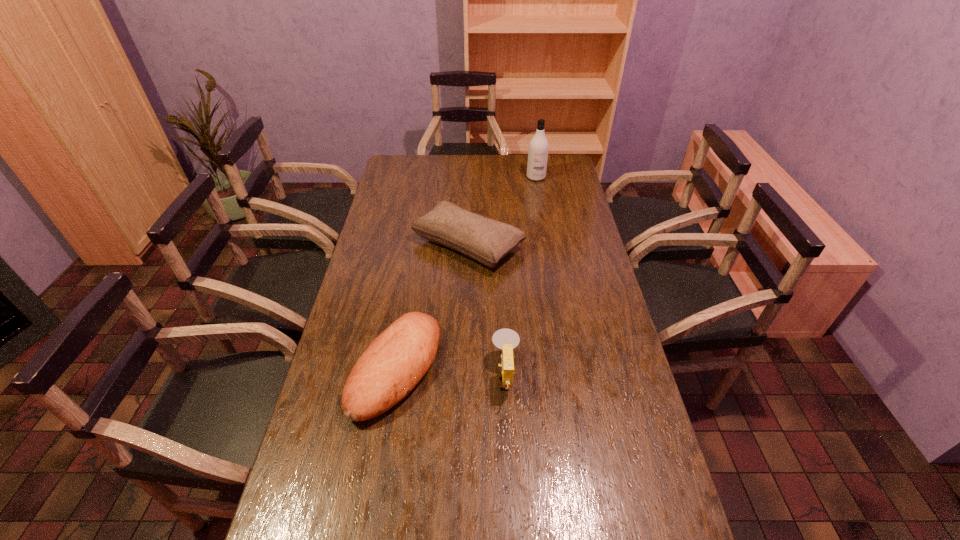
Where is `shampoo`? This screenshot has height=540, width=960. shampoo is located at coordinates (538, 147).

Find the location of `the farthest object`. the farthest object is located at coordinates (538, 147).

Find the location of a particular element. the second farthest object is located at coordinates (485, 240).

Locate an element on the screen. sponge is located at coordinates (506, 339).

Identify the location of bread. The width and height of the screenshot is (960, 540). (394, 363).

Find the location of a particular element. vacant space positioned 0.160m on the front-facing side of the rightmost object is located at coordinates (540, 201).

Image resolution: width=960 pixels, height=540 pixels. I want to click on vacant position located 0.100m on the back of the second farthest object, so click(x=469, y=204).

The image size is (960, 540). I want to click on vacant position located 0.380m on the front-facing side of the sponge, so click(360, 376).

At what (x,y) coordinates should I click in order to perform the action: click on vacant region located 0.320m on the front-facing side of the sponge. Please return your answer as a coordinate pair (x, y). The image size is (960, 540). Looking at the image, I should click on (381, 376).

What are the coordinates of `vacant space located on the front-facing side of the sponge` in the screenshot? It's located at (422, 376).